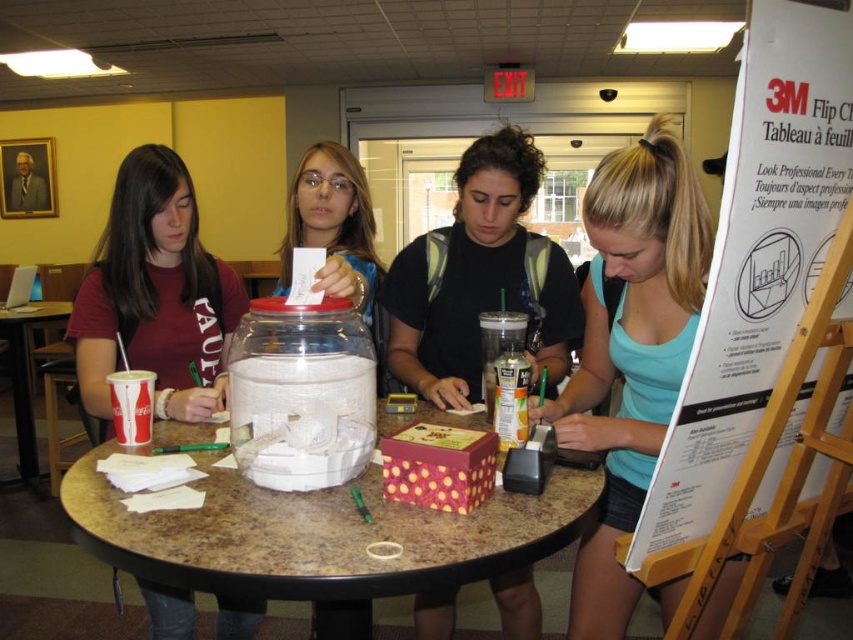
Find the location of a particular element. white paperboard at right is located at coordinates (756, 260).

Which is above, white paperboard at right or marble-patterned table at center?

white paperboard at right is higher up.

Is point (761, 362) closer to viewer compared to point (387, 528)?

Yes, point (761, 362) is closer to viewer.

Image resolution: width=853 pixels, height=640 pixels. I want to click on white paperboard at right, so click(756, 260).

Does marble-patterned table at center have a greater width compared to matte red shirt at left?

Yes.

In order to click on marble-patterned table at center in this screenshot , I will do point(321,540).

Does white paperboard at right have a larger size compared to matte red shirt at left?

Yes.

Does white paperboard at right appear on the right side of matte red shirt at left?

Indeed, white paperboard at right is positioned on the right side of matte red shirt at left.

In the scene shown: Measure the distance between white paperboard at right and camera.

A distance of 29.49 inches exists between white paperboard at right and camera.

Where is `white paperboard at right`? Image resolution: width=853 pixels, height=640 pixels. white paperboard at right is located at coordinates (756, 260).